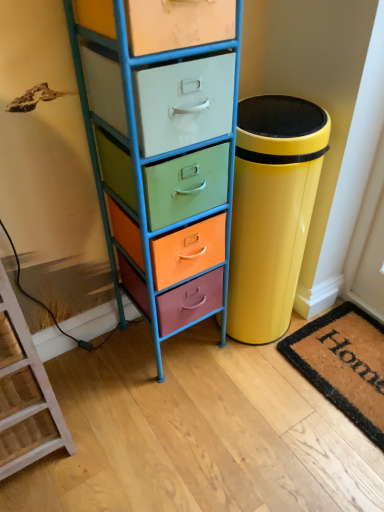
Locate an element on the screen. The image size is (384, 512). free space in front of glossy yellow trash can at right is located at coordinates [242, 395].